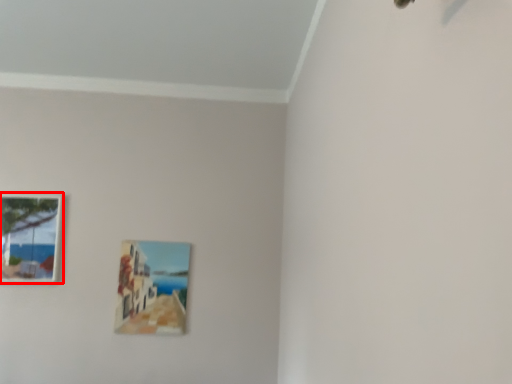
Question: From the image, what is the correct spatial relationship of picture frame (annotated by the red box) in relation to picture frame?

Choices:
 (A) left
 (B) right

Answer: (A)